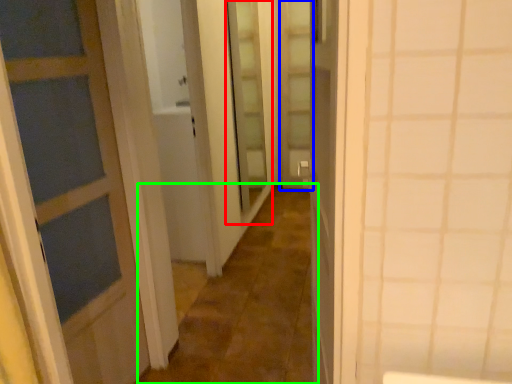
Question: Which is nearer to the screen door (highlighted by a red box)? screen door (highlighted by a blue box) or alley (highlighted by a green box).

Choices:
 (A) screen door
 (B) alley

Answer: (A)